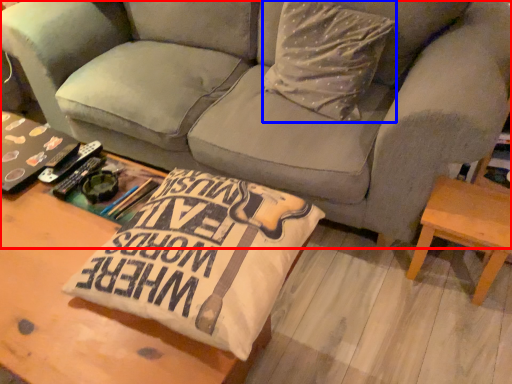
Question: Which of the following is the closest to the observer, studio couch (highlighted by a red box) or throw pillow (highlighted by a blue box)?

Choices:
 (A) studio couch
 (B) throw pillow

Answer: (A)